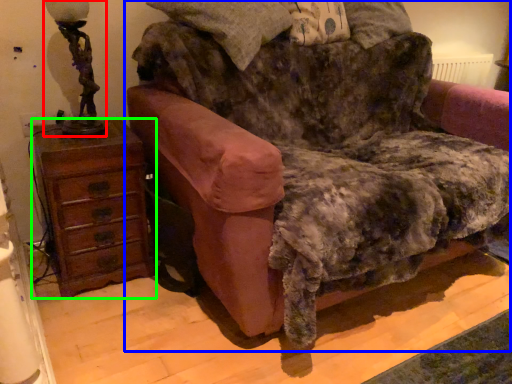
Question: Considering the real-world distances, which object is closest to table lamp (highlighted by a red box)? furniture (highlighted by a blue box) or chest of drawers (highlighted by a green box).

Choices:
 (A) furniture
 (B) chest of drawers

Answer: (B)